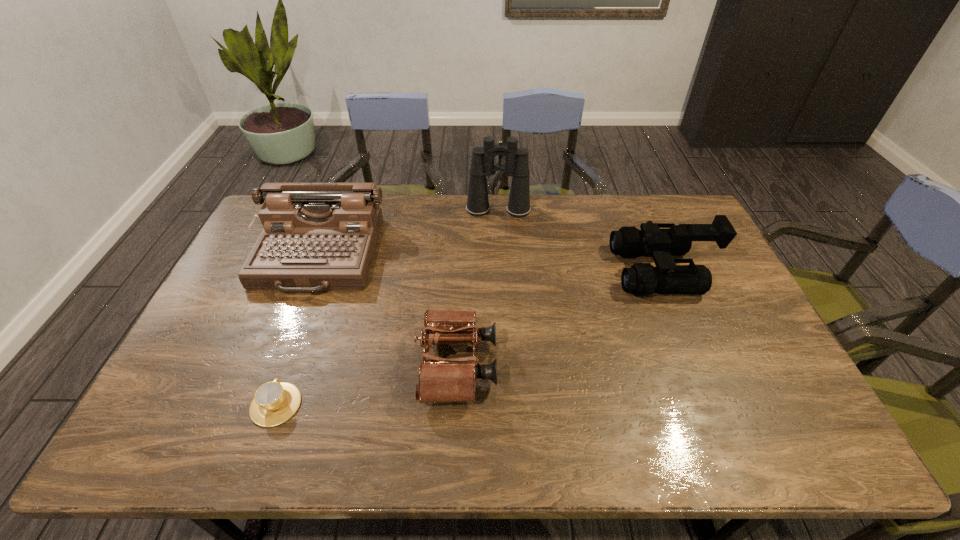
Locate an element on the screen. the farthest binoculars is located at coordinates (516, 165).

Find the location of `the farthest object`. the farthest object is located at coordinates (516, 165).

Find the location of a particular element. typewriter is located at coordinates click(x=316, y=236).

The width and height of the screenshot is (960, 540). In order to click on the second tallest binoculars in this screenshot , I will do tap(642, 279).

At what (x,y) coordinates should I click in order to perform the action: click on the rightmost binoculars. Please return your answer as a coordinate pair (x, y). The width and height of the screenshot is (960, 540). Looking at the image, I should click on (642, 279).

This screenshot has height=540, width=960. What are the coordinates of `the second shortest object` in the screenshot? It's located at (440, 380).

I want to click on the shortest binoculars, so click(x=440, y=380).

Where is `the shortest object`? the shortest object is located at coordinates (274, 402).

The height and width of the screenshot is (540, 960). I want to click on blank area located on the left of the tallest binoculars, so click(382, 210).

Locate an element on the screen. The height and width of the screenshot is (540, 960). vacant region located on the keyboard of the typewriter is located at coordinates (284, 343).